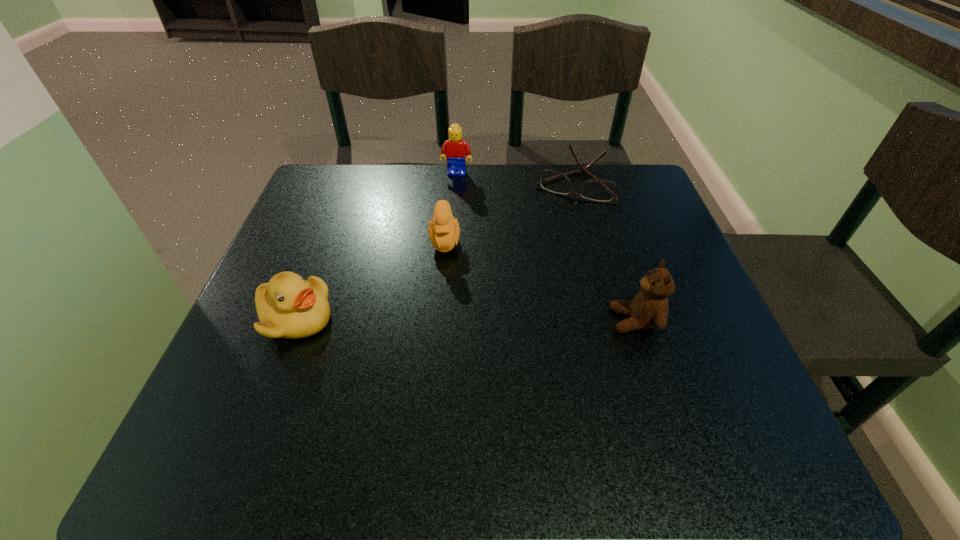
Where is `free spot on the desktop that is between the left duckling and the teddy bear and is positioned on the face of the farther duckling`? Image resolution: width=960 pixels, height=540 pixels. free spot on the desktop that is between the left duckling and the teddy bear and is positioned on the face of the farther duckling is located at coordinates (448, 319).

Locate an element on the screen. free space on the desktop that is between the leftmost object and the teddy bear and is positioned on the front-facing side of the shortest object is located at coordinates (516, 320).

Locate an element on the screen. free spot on the desktop that is between the leftmost object and the teddy bear and is positioned on the front-facing side of the Lego is located at coordinates (420, 319).